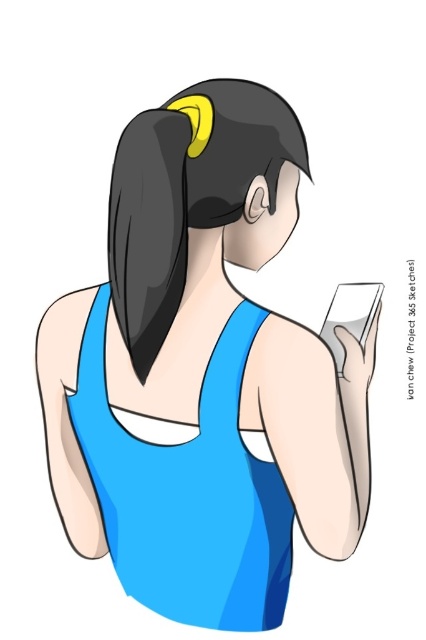
You are an artist trying to draw the figure in the image. You want to ensure proper layering so that the blue matte dress at center and black matte hair at upper center appear three dimensional. Which object should you draw first to create depth?

You should draw the black matte hair at upper center first because it is farther away from the viewer compared to the blue matte dress at center, allowing you to layer the dress on top for a three dimensional effect.

You are an artist sketching this image. You need to decide which object, the matte blue tank top at center or the black shiny hair at upper center, requires more detailed shading due to its size. Which one should you focus on?

The matte blue tank top at center has a larger size compared to the black shiny hair at upper center, so you should focus more detailed shading on the matte blue tank top at center.

You are a fashion designer observing the image. You need to determine the placement of a decorative pin. The pin must be placed on the taller object between the blue matte dress at center and the black shiny hair at upper center. Which object should you choose?

The blue matte dress at center has a greater height compared to the black shiny hair at upper center, so you should place the decorative pin on the blue matte dress at center.